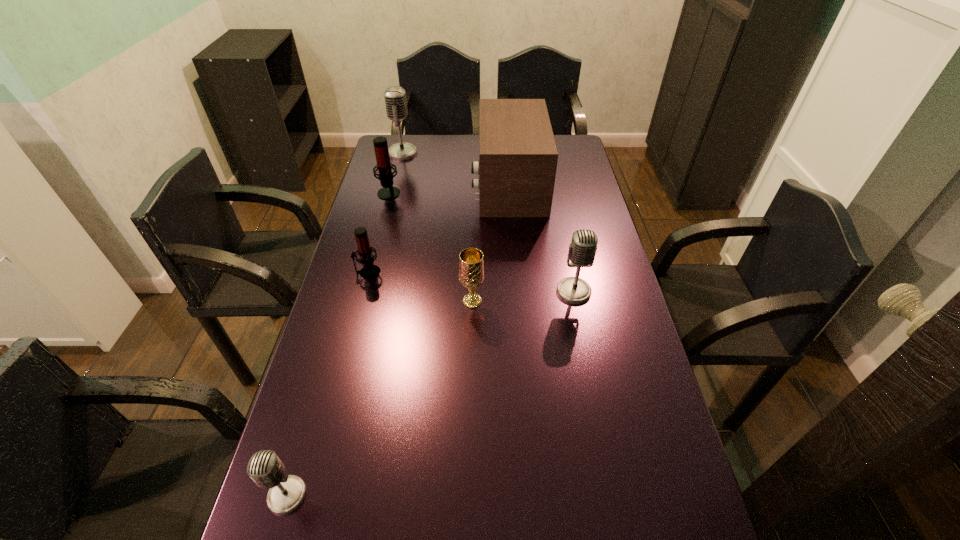
Where is `the smaller red microphone`? the smaller red microphone is located at coordinates (369, 271).

Locate an element on the screen. The height and width of the screenshot is (540, 960). vacant space located 0.090m on the back of the biggest gray microphone is located at coordinates (407, 135).

At what (x,y) coordinates should I click in order to perform the action: click on vacant space located on the front-facing side of the radio receiver. Please return your answer as a coordinate pair (x, y). Looking at the image, I should click on (456, 185).

This screenshot has height=540, width=960. What are the coordinates of `blank area located 0.250m on the front-facing side of the radio receiver` in the screenshot? It's located at (406, 185).

Locate an element on the screen. free space located 0.200m on the front-facing side of the radio receiver is located at coordinates (420, 185).

At what (x,y) coordinates should I click in order to perform the action: click on vacant area situated on the front of the second farthest microphone. Please return your answer as a coordinate pair (x, y). Looking at the image, I should click on (372, 262).

The width and height of the screenshot is (960, 540). Identify the location of free space located 0.370m on the front of the second farthest gray microphone. (602, 430).

Find the location of `vacant space positioned on the front of the chalice`. vacant space positioned on the front of the chalice is located at coordinates (470, 369).

The height and width of the screenshot is (540, 960). Identify the location of free space located 0.370m on the back of the smallest gray microphone. (335, 333).

What are the coordinates of `free space located 0.320m on the right of the nearer red microphone` in the screenshot? It's located at (487, 272).